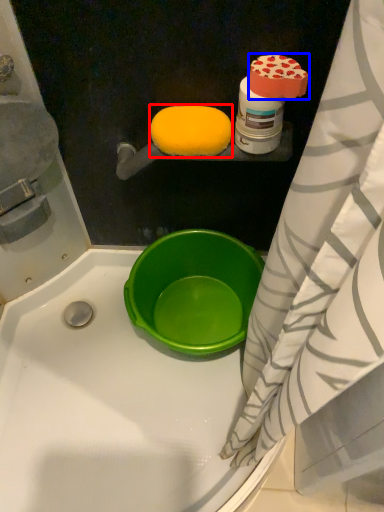
Question: Which point is further to the camera, food (highlighted by a red box) or food (highlighted by a blue box)?

Choices:
 (A) food
 (B) food

Answer: (A)